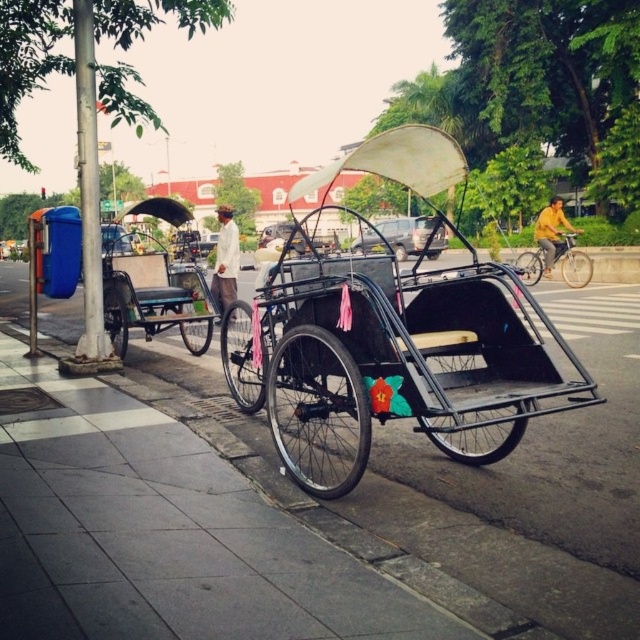
Which of these two, metallic blue rickshaw at left or yellow fabric shirt at center, stands shorter?

With less height is metallic blue rickshaw at left.

Who is positioned more to the left, metallic blue rickshaw at left or yellow fabric shirt at center?

metallic blue rickshaw at left is more to the left.

Is point (122, 321) in front of point (554, 204)?

Yes, point (122, 321) is in front of point (554, 204).

Image resolution: width=640 pixels, height=640 pixels. Identify the location of metallic blue rickshaw at left. (150, 292).

Is point (509, 483) closer to viewer compared to point (538, 227)?

Yes, it is.

You are a GUI agent. You are given a task and a screenshot of the screen. Output one action in this format:
    pyautogui.click(x=<x>, y=<y>)
    Task: Click on the metallic pavement at center
    This screenshot has height=640, width=640.
    Given the screenshot: What is the action you would take?
    (531, 496)

Which is in front, point (474, 470) or point (540, 236)?

Point (474, 470)

Locate an element on the screen. metallic pavement at center is located at coordinates (531, 496).

Describe the element at coordinates (150, 292) in the screenshot. The width and height of the screenshot is (640, 640). I see `metallic blue rickshaw at left` at that location.

Is metallic blue rickshaw at left smaller than silver metallic bicycle at center?

Actually, metallic blue rickshaw at left might be larger than silver metallic bicycle at center.

What do you see at coordinates (150, 292) in the screenshot? I see `metallic blue rickshaw at left` at bounding box center [150, 292].

In order to click on metallic blue rickshaw at left in this screenshot , I will do `click(150, 292)`.